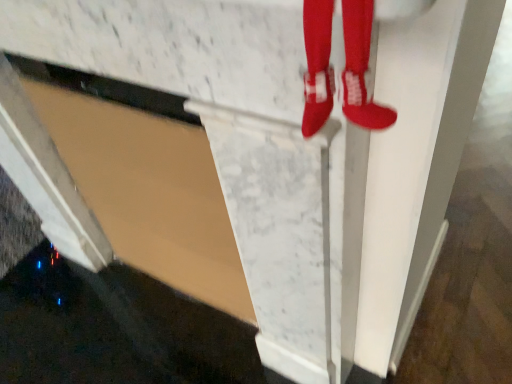
Image resolution: width=512 pixels, height=384 pixels. I want to click on metallic silver exhaust hood at lower left, so click(x=46, y=178).

Describe the element at coordinates (46, 178) in the screenshot. This screenshot has height=384, width=512. I see `metallic silver exhaust hood at lower left` at that location.

Find the location of a particular element. The image size is (512, 384). metallic silver exhaust hood at lower left is located at coordinates (46, 178).